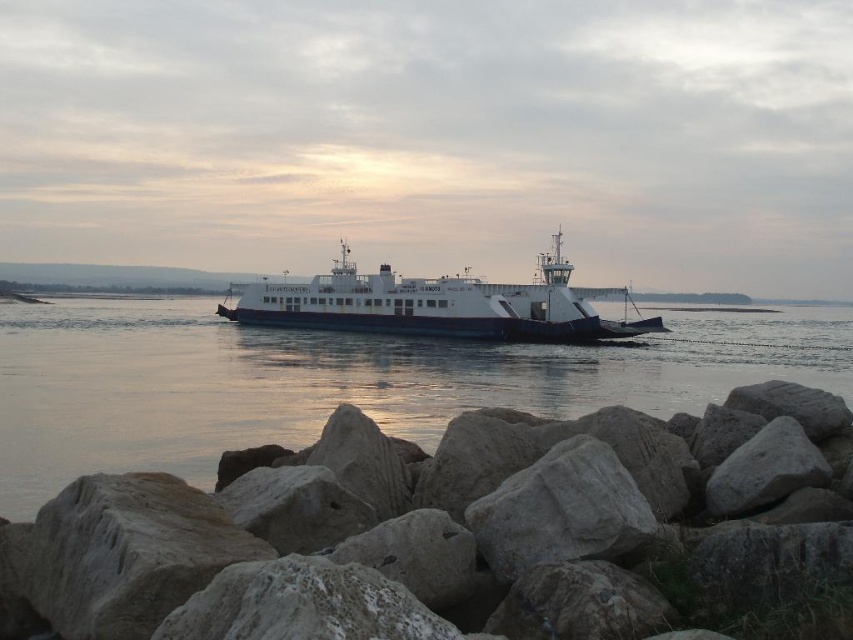
Question: Does gray rock at lower center have a smaller size compared to smooth water at center?

Choices:
 (A) no
 (B) yes

Answer: (B)

Question: Which is nearer to the smooth water at center?

Choices:
 (A) white matte ferry at center
 (B) gray rock at lower center

Answer: (A)

Question: Is gray rock at lower center bigger than white matte ferry at center?

Choices:
 (A) no
 (B) yes

Answer: (A)

Question: Can you confirm if smooth water at center is positioned below white matte ferry at center?

Choices:
 (A) yes
 (B) no

Answer: (A)

Question: Which point is closer to the camera taking this photo?

Choices:
 (A) (782, 349)
 (B) (532, 340)

Answer: (A)

Question: Which point is closer to the camera?

Choices:
 (A) [x=560, y=362]
 (B) [x=772, y=500]

Answer: (B)